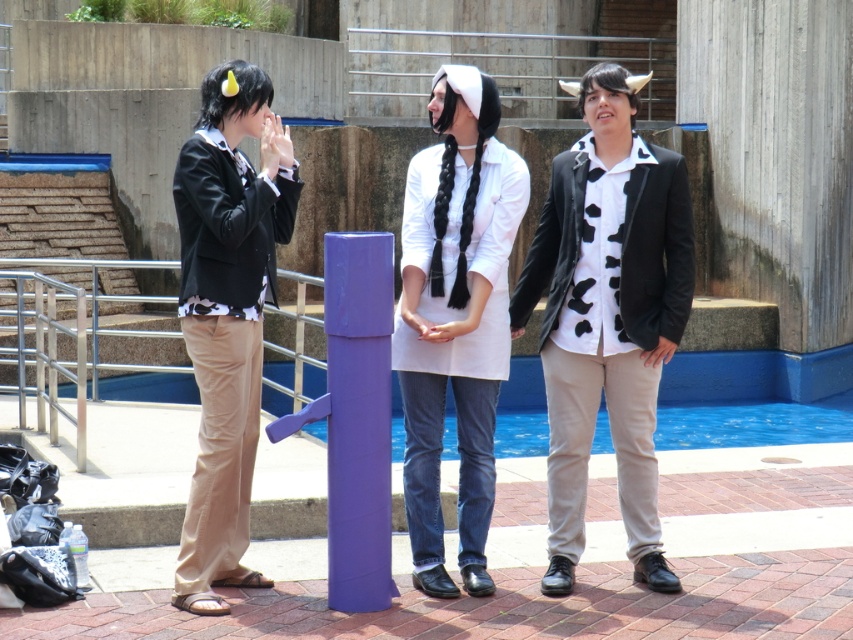
You are a photographer at the event and need to ensure that both the matte black jacket at center and the white matte shirt at center are visible in your photo. Given their sizes, which object should you focus on to capture both without cropping?

Since the matte black jacket at center is larger in size than the white matte shirt at center, you should focus on the matte black jacket at center as it occupies more space, ensuring the smaller white matte shirt at center remains visible in the frame.

You are a photographer at the event and need to capture a photo where the white matte shirt at center and the matte black jacket at left are both visible. Based on their positions, which object is higher in the frame?

The white matte shirt at center is located above the matte black jacket at left, so it will appear higher in the frame.